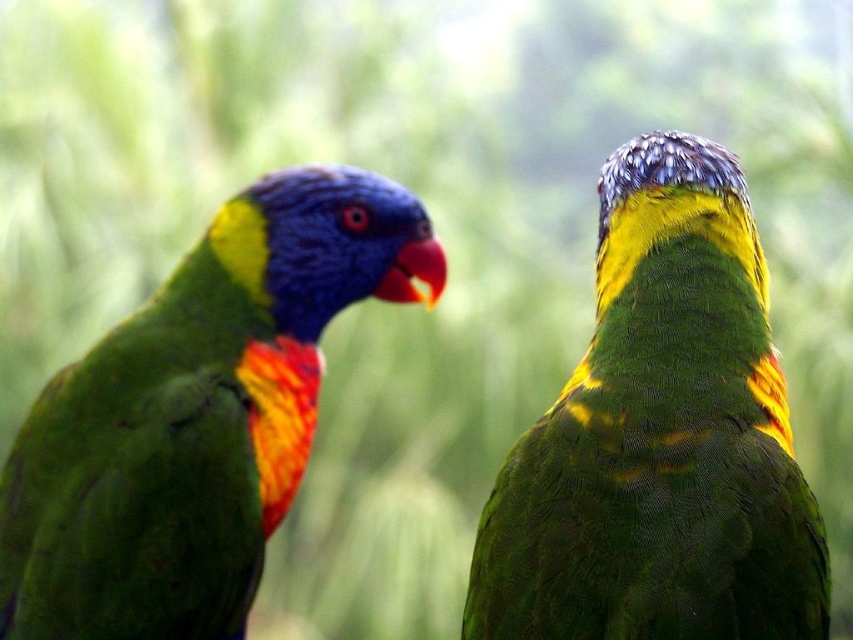
Is green matte parrot at upper right shorter than shiny multicolored parrot at left?

Yes, green matte parrot at upper right is shorter than shiny multicolored parrot at left.

Does point (755, 552) come in front of point (155, 337)?

Yes, point (755, 552) is in front of point (155, 337).

Locate an element on the screen. The height and width of the screenshot is (640, 853). green matte parrot at upper right is located at coordinates (660, 438).